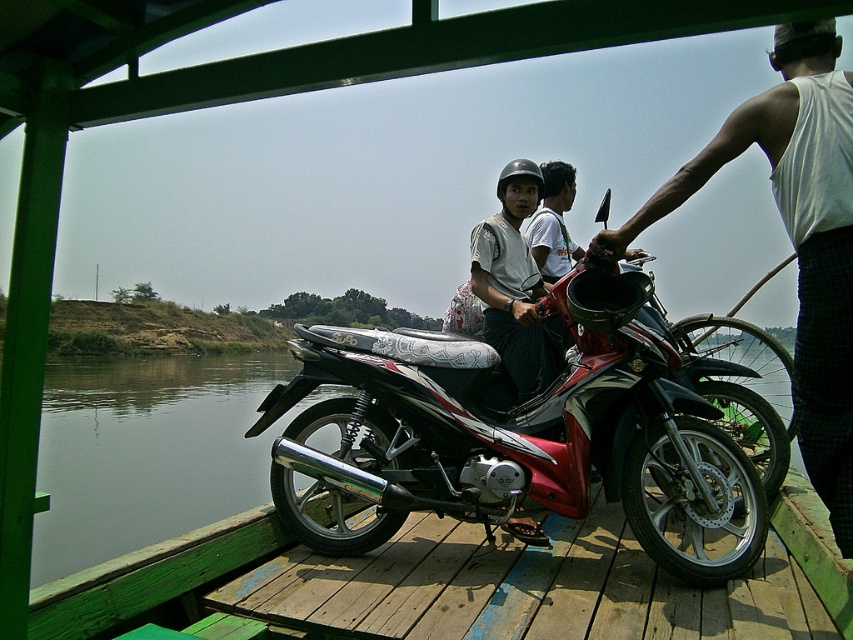
Question: Which of these objects is positioned closest to the matte white shirt at center?

Choices:
 (A) white shirt at center
 (B) white tank top at right
 (C) shiny red motorcycle at center

Answer: (A)

Question: Is shiny red motorcycle at center wider than white shirt at center?

Choices:
 (A) no
 (B) yes

Answer: (B)

Question: Which point is farther to the camera?

Choices:
 (A) white tank top at right
 (B) matte white shirt at center
 (C) white shirt at center

Answer: (C)

Question: Is shiny red motorcycle at center to the right of white tank top at right from the viewer's perspective?

Choices:
 (A) no
 (B) yes

Answer: (A)

Question: Which object is positioned closest to the shiny red motorcycle at center?

Choices:
 (A) matte white shirt at center
 (B) white tank top at right
 (C) white shirt at center

Answer: (A)

Question: Where is white tank top at right located in relation to white shirt at center in the image?

Choices:
 (A) below
 (B) above

Answer: (A)